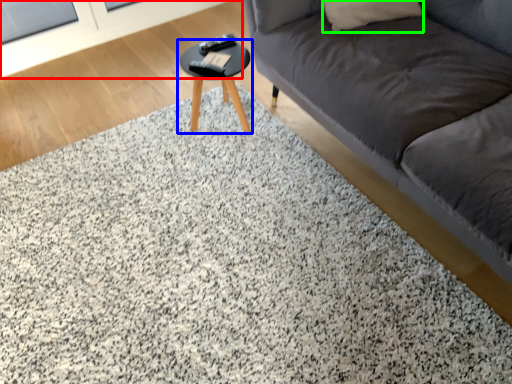
Question: Considering the real-world distances, which object is farthest from screen door (highlighted by a red box)? table (highlighted by a blue box) or pillow (highlighted by a green box)?

Choices:
 (A) table
 (B) pillow

Answer: (B)